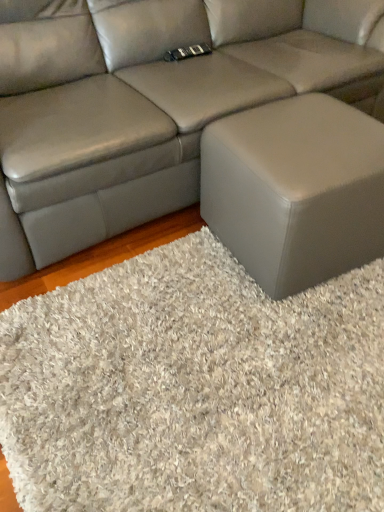
Find the location of a particular element. Image resolution: width=384 pixels, height=512 pixels. free space to the left of matte gray ottoman at lower right is located at coordinates (168, 282).